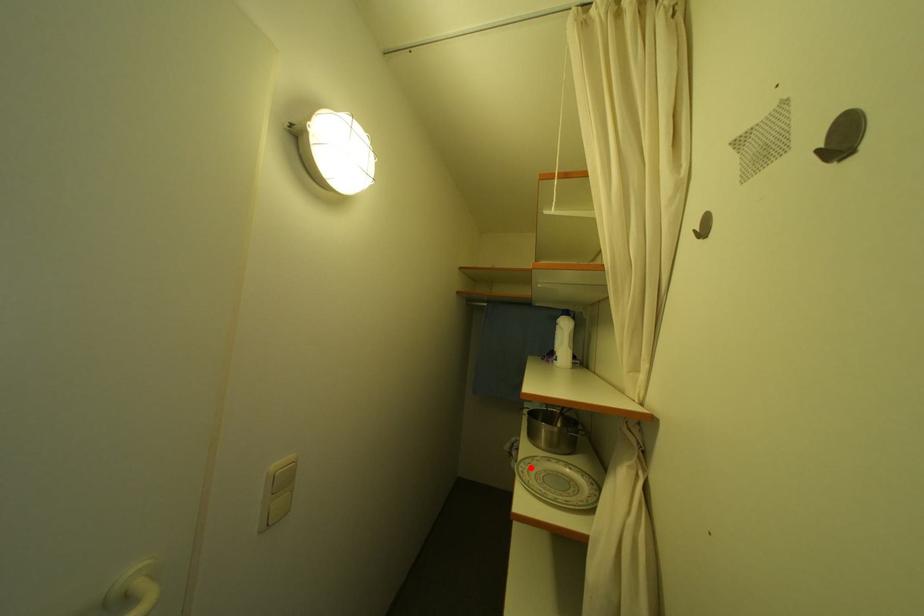
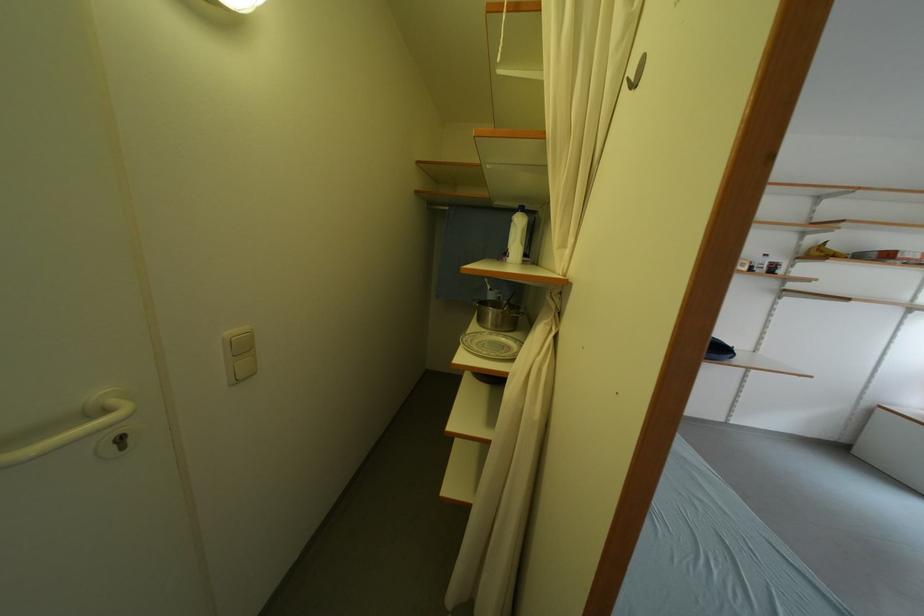
Find the pixel in the second image that matches the highlighted location in the first image.

(476, 339)